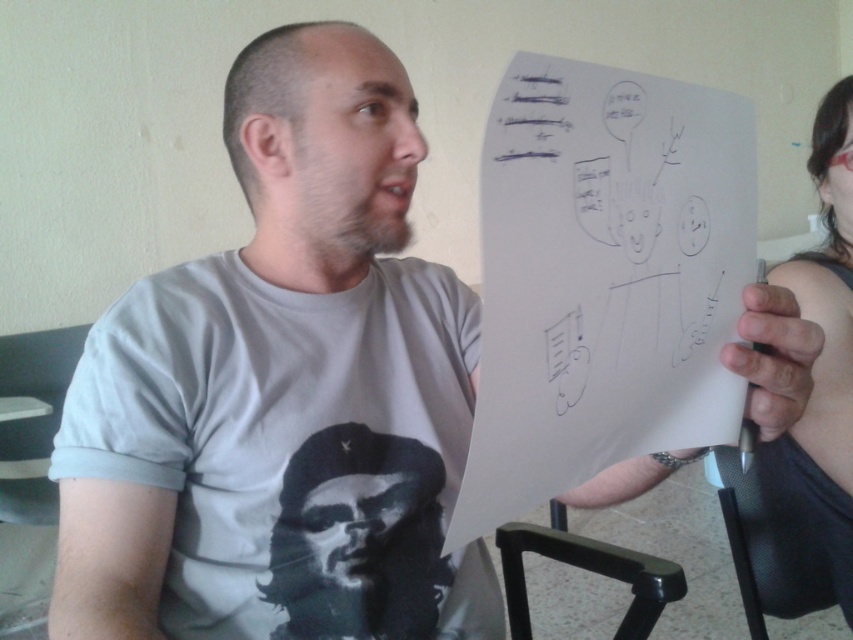
You are a photographer trying to capture a clear shot of the black plastic chair at lower center and the black ink lines at upper center. Which object should you focus on first to ensure both are in focus?

The black plastic chair at lower center is much taller than the black ink lines at upper center, so you should focus on the black plastic chair at lower center first to ensure both are in focus.

You are a photographer trying to capture a closeup of the black plastic chair at lower center and the black ink lines at upper center in the scene. Since you want both objects to appear clearly in the photo, which object should you focus on to ensure it is in sharp focus first?

The black plastic chair at lower center is bigger than the black ink lines at upper center, so focusing on the black plastic chair at lower center first will ensure it is in sharp focus, and the black ink lines at upper center will likely be in focus as well due to its smaller size.